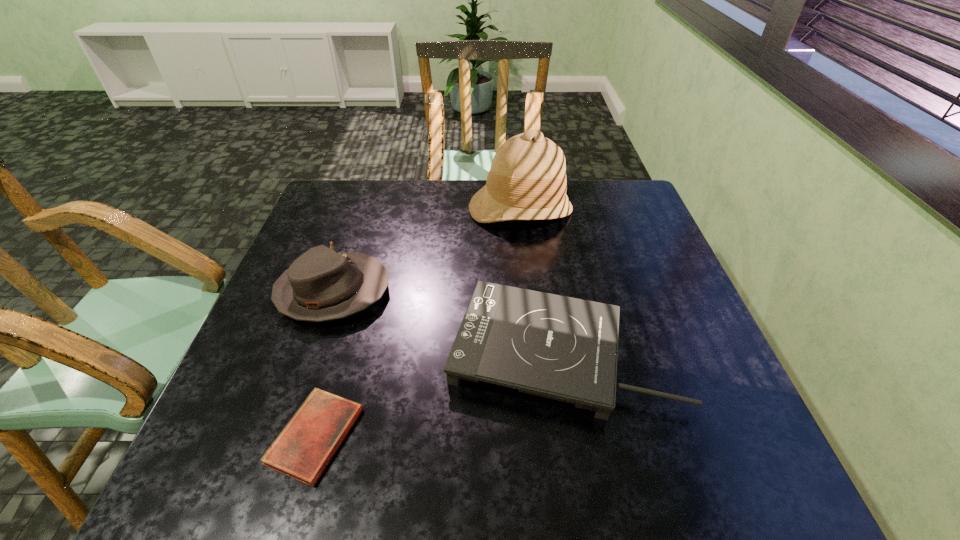
The image size is (960, 540). I want to click on vacant area that lies between the hotplate and the nearer hat, so click(x=446, y=322).

The image size is (960, 540). In order to click on free space that is in between the diary and the farthest object in this screenshot , I will do `click(419, 322)`.

At what (x,y) coordinates should I click in order to perform the action: click on free space between the taller hat and the diary. Please return your answer as a coordinate pair (x, y). Looking at the image, I should click on (419, 322).

You are a GUI agent. You are given a task and a screenshot of the screen. Output one action in this format:
    pyautogui.click(x=<x>, y=<y>)
    Task: Click on the object that stands as the second closest to the hotplate
    This screenshot has height=540, width=960.
    Given the screenshot: What is the action you would take?
    pyautogui.click(x=303, y=449)

Locate which object ranks in proximity to the second shortest object. Please provide its 2D coordinates. Your answer should be formatted as a tuple, i.e. [(x, y)], where the tuple contains the x and y coordinates of a point satisfying the conditions above.

[(320, 285)]

You are a GUI agent. You are given a task and a screenshot of the screen. Output one action in this format:
    pyautogui.click(x=<x>, y=<y>)
    Task: Click on the free space that satisfies the following two spatial constraints: 1. on the decorative side of the hotplate; 2. on the right side of the third shortest object
    Image resolution: width=960 pixels, height=540 pixels.
    Given the screenshot: What is the action you would take?
    [x=312, y=351]

At what (x,y) coordinates should I click in order to perform the action: click on vacant position in the image that satisfies the following two spatial constraints: 1. on the decorative side of the second tallest object; 2. on the left side of the third tallest object. Please return your answer as a coordinate pair (x, y). This screenshot has width=960, height=540. Looking at the image, I should click on (312, 351).

Find the location of a particular element. free region that satisfies the following two spatial constraints: 1. on the back side of the diary; 2. on the decorative side of the left hat is located at coordinates (357, 292).

Where is `free location that satisfies the following two spatial constraints: 1. on the decorative side of the shorter hat; 2. on the left side of the hotplate`? The width and height of the screenshot is (960, 540). free location that satisfies the following two spatial constraints: 1. on the decorative side of the shorter hat; 2. on the left side of the hotplate is located at coordinates (312, 351).

You are a GUI agent. You are given a task and a screenshot of the screen. Output one action in this format:
    pyautogui.click(x=<x>, y=<y>)
    Task: Click on the free location that satisfies the following two spatial constraints: 1. on the front-facing side of the tallest object; 2. on the decorative side of the nearer hat
    
    Given the screenshot: What is the action you would take?
    pyautogui.click(x=530, y=292)